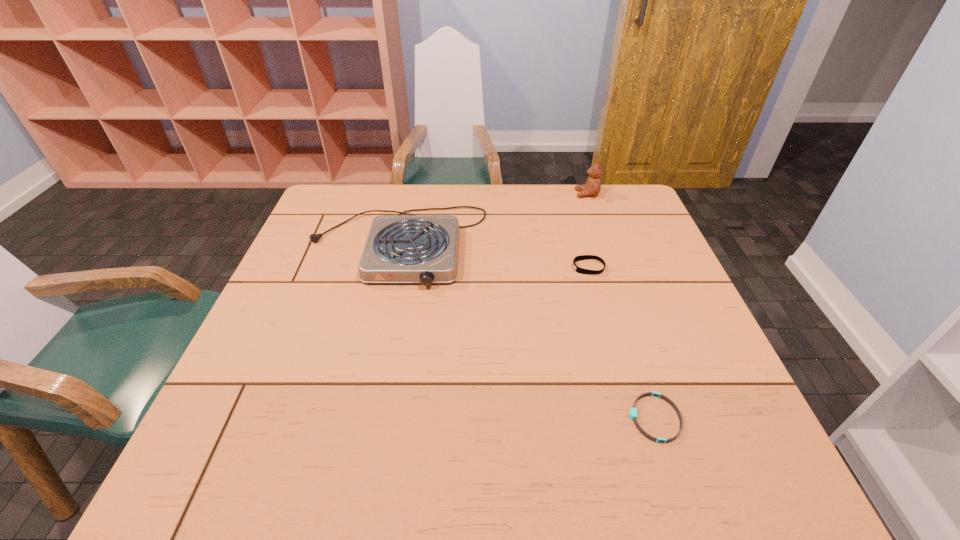
Locate an element on the screen. The width and height of the screenshot is (960, 540). teddy bear is located at coordinates (592, 187).

Locate an element on the screen. The height and width of the screenshot is (540, 960). the tallest object is located at coordinates (592, 187).

At what (x,y) coordinates should I click in order to perform the action: click on the third shortest object. Please return your answer as a coordinate pair (x, y). Looking at the image, I should click on (408, 248).

This screenshot has width=960, height=540. I want to click on hotplate, so click(408, 248).

Locate an element on the screen. This screenshot has height=540, width=960. the farther wristband is located at coordinates (582, 257).

In order to click on the taller wristband in this screenshot , I will do `click(582, 257)`.

Where is `the nearer wristband`? the nearer wristband is located at coordinates (633, 415).

Where is `the nearest object`? This screenshot has width=960, height=540. the nearest object is located at coordinates (633, 415).

Find the location of a particular element. vacant region located on the face of the tallest object is located at coordinates (481, 194).

Locate an element on the screen. The image size is (960, 540). blank area located 0.060m on the face of the tallest object is located at coordinates (557, 194).